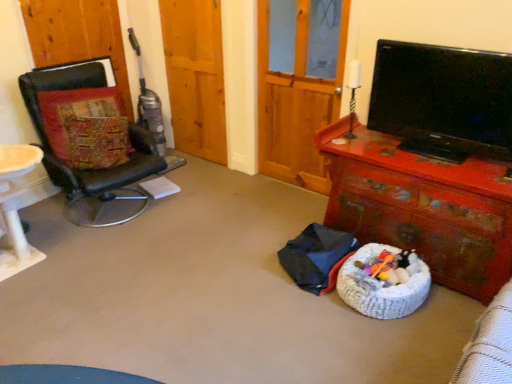
Question: Are wooden screen door at upper center, which is counted as the 1th screen door, starting from the left, and rusty wooden desk at lower right making contact?

Choices:
 (A) no
 (B) yes

Answer: (A)

Question: Is wooden screen door at upper center, acting as the second screen door starting from the right, at the right side of rusty wooden desk at lower right?

Choices:
 (A) yes
 (B) no

Answer: (B)

Question: Is wooden screen door at upper center, which is counted as the 1th screen door, starting from the left, smaller than rusty wooden desk at lower right?

Choices:
 (A) yes
 (B) no

Answer: (A)

Question: Is wooden screen door at upper center, acting as the second screen door starting from the right, positioned with its back to rusty wooden desk at lower right?

Choices:
 (A) no
 (B) yes

Answer: (A)

Question: Could you tell me if wooden screen door at upper center, which is counted as the 1th screen door, starting from the left, is facing rusty wooden desk at lower right?

Choices:
 (A) yes
 (B) no

Answer: (B)

Question: Can you confirm if wooden screen door at upper center, which is counted as the 1th screen door, starting from the left, is positioned to the left of rusty wooden desk at lower right?

Choices:
 (A) yes
 (B) no

Answer: (A)

Question: Is white woven dog bed at lower center further to the viewer compared to rusty wooden desk at lower right?

Choices:
 (A) yes
 (B) no

Answer: (A)

Question: Considering the relative sizes of white woven dog bed at lower center and rusty wooden desk at lower right in the image provided, is white woven dog bed at lower center smaller than rusty wooden desk at lower right?

Choices:
 (A) yes
 (B) no

Answer: (A)

Question: Is white woven dog bed at lower center at the right side of rusty wooden desk at lower right?

Choices:
 (A) yes
 (B) no

Answer: (B)

Question: Does white woven dog bed at lower center have a greater width compared to rusty wooden desk at lower right?

Choices:
 (A) no
 (B) yes

Answer: (A)

Question: From the image's perspective, is white woven dog bed at lower center beneath rusty wooden desk at lower right?

Choices:
 (A) no
 (B) yes

Answer: (B)

Question: From a real-world perspective, is white woven dog bed at lower center located higher than rusty wooden desk at lower right?

Choices:
 (A) no
 (B) yes

Answer: (A)

Question: Is dark blue fabric at center taller than wooden screen door at upper center, acting as the second screen door starting from the right?

Choices:
 (A) no
 (B) yes

Answer: (A)